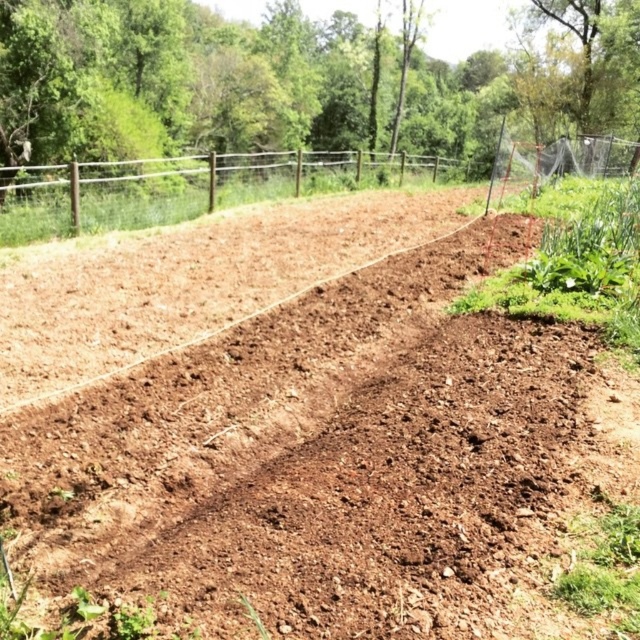
Question: Is brown soil at center positioned before brown wooden fence at upper center?

Choices:
 (A) yes
 (B) no

Answer: (A)

Question: Among these objects, which one is nearest to the camera?

Choices:
 (A) brown soil at center
 (B) brown wooden fence at upper center

Answer: (A)

Question: Is brown soil at center to the left of brown wooden fence at upper center from the viewer's perspective?

Choices:
 (A) yes
 (B) no

Answer: (B)

Question: Can you confirm if brown soil at center is positioned to the left of brown wooden fence at upper center?

Choices:
 (A) no
 (B) yes

Answer: (A)

Question: Which point appears closest to the camera in this image?

Choices:
 (A) (227, 451)
 (B) (3, 221)

Answer: (A)